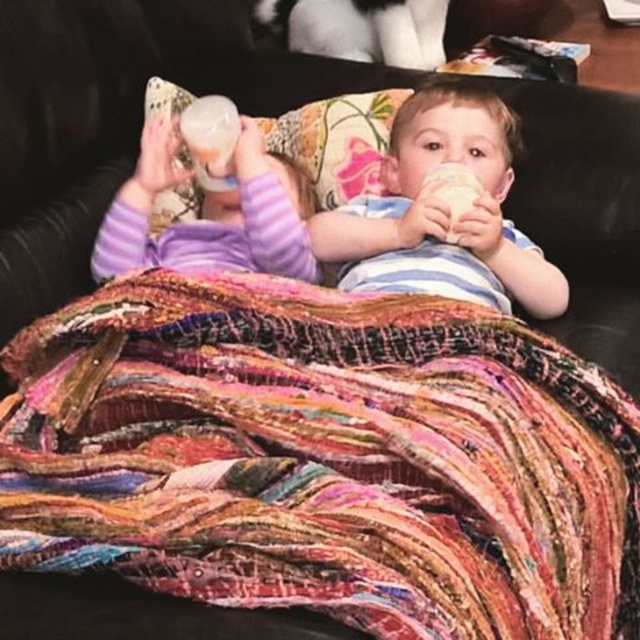
Based on the photo, does multicolored woven fabric at center have a smaller size compared to purple fleece onesie at left?

No, multicolored woven fabric at center is not smaller than purple fleece onesie at left.

Which is below, multicolored woven fabric at center or purple fleece onesie at left?

Positioned lower is multicolored woven fabric at center.

Where is `multicolored woven fabric at center`? multicolored woven fabric at center is located at coordinates (324, 458).

This screenshot has height=640, width=640. I want to click on multicolored woven fabric at center, so click(324, 458).

Who is taller, black leather couch at center or striped cotton shirt at center?

With more height is black leather couch at center.

Does black leather couch at center appear over striped cotton shirt at center?

Indeed, black leather couch at center is positioned over striped cotton shirt at center.

Is point (70, 58) behind point (371, 230)?

Yes, point (70, 58) is behind point (371, 230).

Where is `black leather couch at center`? This screenshot has height=640, width=640. black leather couch at center is located at coordinates (116, 116).

This screenshot has width=640, height=640. What do you see at coordinates (324, 458) in the screenshot?
I see `multicolored woven fabric at center` at bounding box center [324, 458].

Is multicolored woven fabric at center closer to the viewer compared to black leather couch at center?

That is True.

Measure the distance between multicolored woven fabric at center and camera.

multicolored woven fabric at center and camera are 81.86 centimeters apart from each other.

Identify the location of multicolored woven fabric at center. (324, 458).